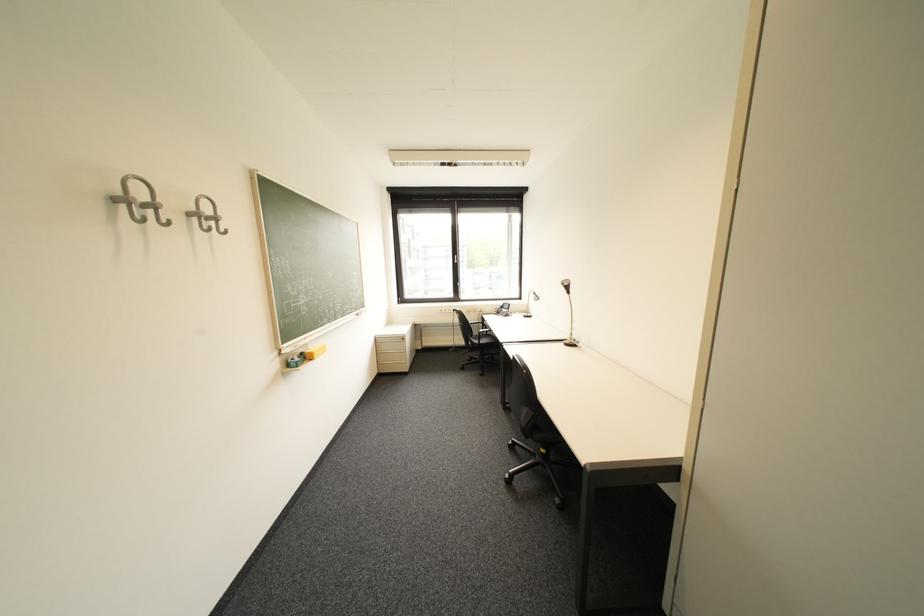
Locate an element on the screen. Image resolution: width=924 pixels, height=616 pixels. chair armrest is located at coordinates (485, 331).